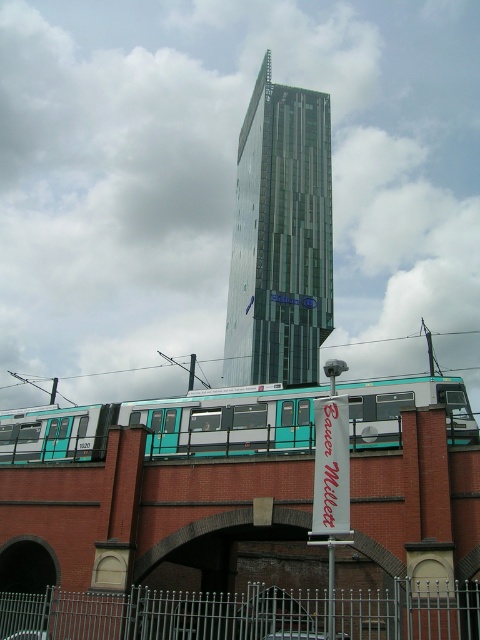
Question: Which object is farther from the camera taking this photo?

Choices:
 (A) glassy metallic skyscraper at center
 (B) teal matte train at center

Answer: (A)

Question: Is glassy metallic skyscraper at center to the left of teal matte train at center from the viewer's perspective?

Choices:
 (A) yes
 (B) no

Answer: (B)

Question: Among these points, which one is farthest from the camera?

Choices:
 (A) (21, 429)
 (B) (300, 292)

Answer: (B)

Question: Is glassy metallic skyscraper at center bigger than teal matte train at center?

Choices:
 (A) yes
 (B) no

Answer: (A)

Question: Can you confirm if glassy metallic skyscraper at center is positioned above teal matte train at center?

Choices:
 (A) yes
 (B) no

Answer: (A)